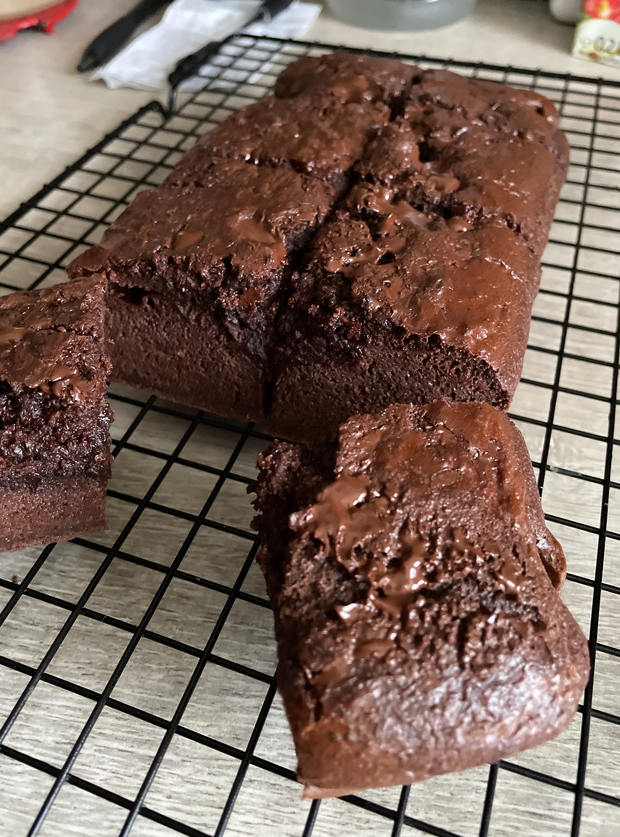
Find the location of a particular element. The width and height of the screenshot is (620, 837). red plate side is located at coordinates (53, 11).